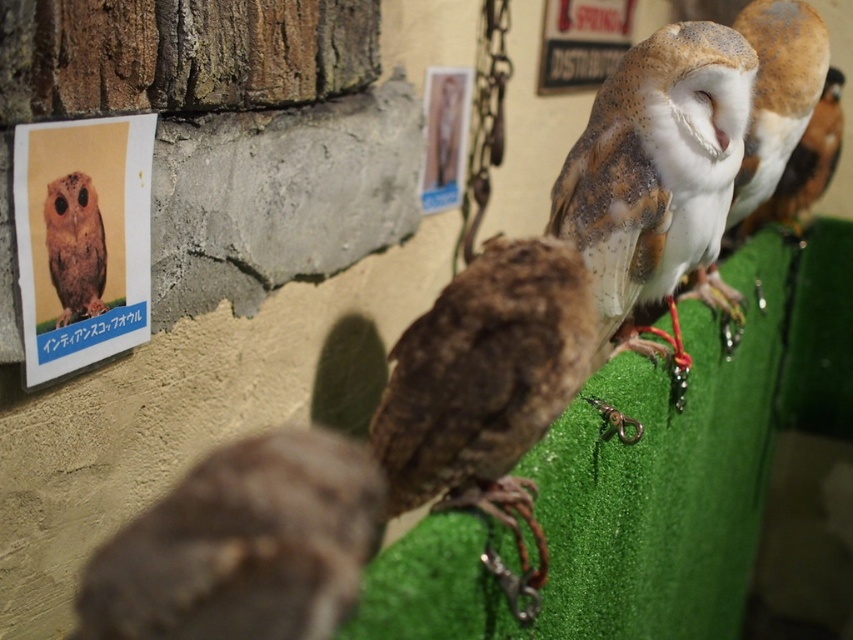
Can you confirm if speckled feathered owl at upper right is thinner than brown speckled owl at upper left?

In fact, speckled feathered owl at upper right might be wider than brown speckled owl at upper left.

Who is taller, speckled feathered owl at upper right or brown speckled owl at upper left?

speckled feathered owl at upper right is taller.

Does point (659, 86) come behind point (103, 310)?

Yes.

The image size is (853, 640). Find the location of `speckled feathered owl at upper right`. speckled feathered owl at upper right is located at coordinates (654, 170).

Between brown fuzzy owl at center and brown speckled owl at upper left, which one is positioned lower?

brown fuzzy owl at center

Who is shorter, brown fuzzy owl at center or brown speckled owl at upper left?

Standing shorter between the two is brown fuzzy owl at center.

Find the location of `brown fuzzy owl at center`. brown fuzzy owl at center is located at coordinates (242, 545).

Can you confirm if brown fuzzy owl at center is positioned below speckled feathered owl at upper right?

Yes.

Who is more forward, (280, 472) or (611, 225)?

Positioned in front is point (280, 472).

At what (x,y) coordinates should I click in order to perform the action: click on brown fuzzy owl at center. Please return your answer as a coordinate pair (x, y). Looking at the image, I should click on (242, 545).